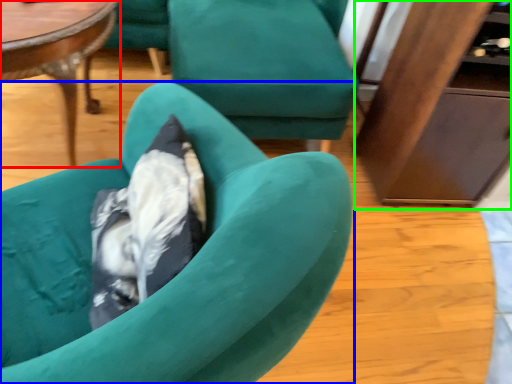
Question: Which object is the farthest from coffee table (highlighted by a red box)? Choose among these: chair (highlighted by a blue box) or dresser (highlighted by a green box).

Choices:
 (A) chair
 (B) dresser

Answer: (B)